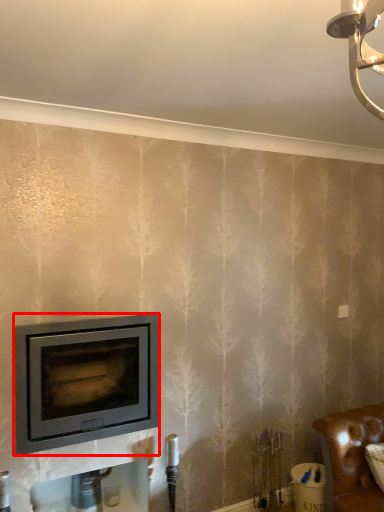
Question: From the image's perspective, where is wood burning stove (annotated by the red box) located in relation to furniture in the image?

Choices:
 (A) below
 (B) above

Answer: (B)